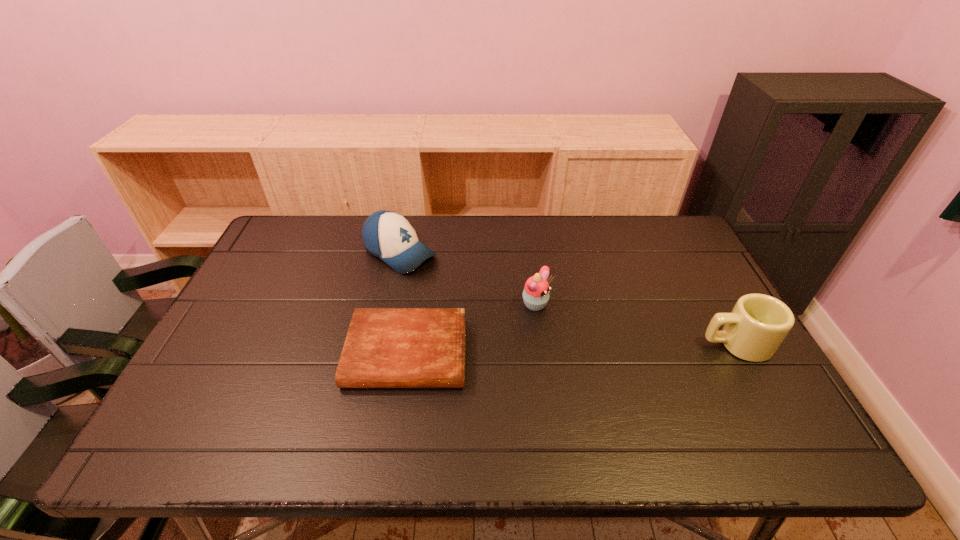
The image size is (960, 540). Identify the location of free space located on the front-facing side of the farthest object. (519, 322).

Find the location of a particular element. vacant space positioned 0.310m on the front-facing side of the farthest object is located at coordinates (505, 314).

Locate an element on the screen. vacant space located 0.210m on the face of the second farthest object is located at coordinates (617, 354).

Locate an element on the screen. free space located on the face of the second farthest object is located at coordinates (632, 362).

What are the coordinates of `vacant space situated 0.210m on the face of the second farthest object` in the screenshot? It's located at (617, 354).

Where is `object present at the far edge`? object present at the far edge is located at coordinates [x=389, y=236].

Where is `object positioned at the near edge`? The width and height of the screenshot is (960, 540). object positioned at the near edge is located at coordinates (385, 347).

Identify the location of object located in the right edge section of the desktop. This screenshot has height=540, width=960. (758, 324).

The width and height of the screenshot is (960, 540). In the image, there is a desktop. What are the coordinates of `vacant space at the far edge` in the screenshot? It's located at (519, 228).

In the image, there is a desktop. Where is `free region at the near edge`? free region at the near edge is located at coordinates (663, 403).